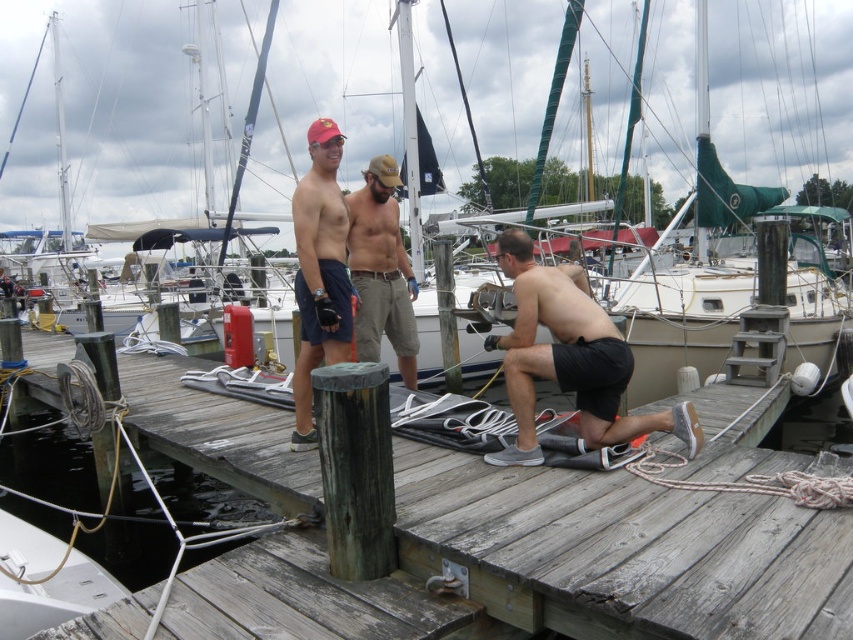
Question: Is weathered wood dock at center positioned at the back of tan cotton shorts at center?

Choices:
 (A) no
 (B) yes

Answer: (B)

Question: Considering the real-world distances, which object is closest to the tan cotton shorts at center?

Choices:
 (A) white matte sailboat at center
 (B) weathered wood dock at center
 (C) matte black shorts at center

Answer: (C)

Question: Is white matte sailboat at center positioned before black matte shorts at center?

Choices:
 (A) yes
 (B) no

Answer: (B)

Question: Which object is farther from the camera taking this photo?

Choices:
 (A) white matte sailboat at center
 (B) black matte shorts at center
 (C) tan cotton shorts at center

Answer: (A)

Question: Is matte black shorts at center wider than tan cotton shorts at center?

Choices:
 (A) no
 (B) yes

Answer: (B)

Question: Considering the real-world distances, which object is farthest from the tan cotton shorts at center?

Choices:
 (A) black matte shorts at center
 (B) white matte sailboat at center
 (C) matte black shorts at center
 (D) weathered wood dock at center

Answer: (B)